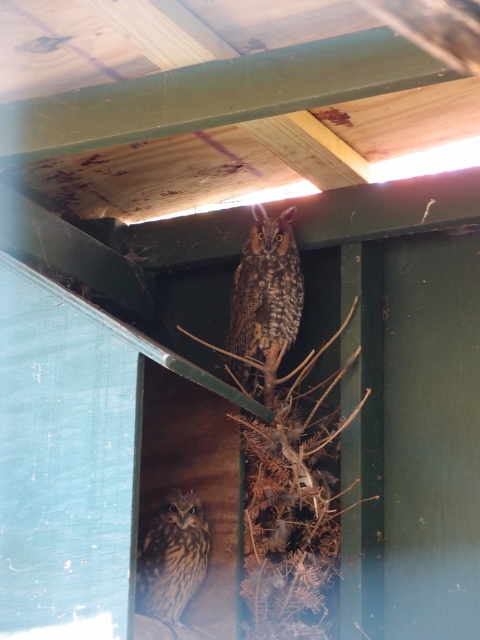
Question: Does brown speckled owl at upper center lie behind brown speckled owl at lower left?

Choices:
 (A) no
 (B) yes

Answer: (B)

Question: Is brown speckled owl at upper center wider than brown speckled owl at lower left?

Choices:
 (A) no
 (B) yes

Answer: (B)

Question: In this image, where is brown speckled owl at upper center located relative to brown speckled owl at lower left?

Choices:
 (A) left
 (B) right

Answer: (B)

Question: Which of the following is the farthest from the observer?

Choices:
 (A) brown speckled owl at lower left
 (B) brown speckled owl at upper center

Answer: (B)

Question: Which point is farther from the camera taking this photo?

Choices:
 (A) (157, 602)
 (B) (279, 234)

Answer: (B)